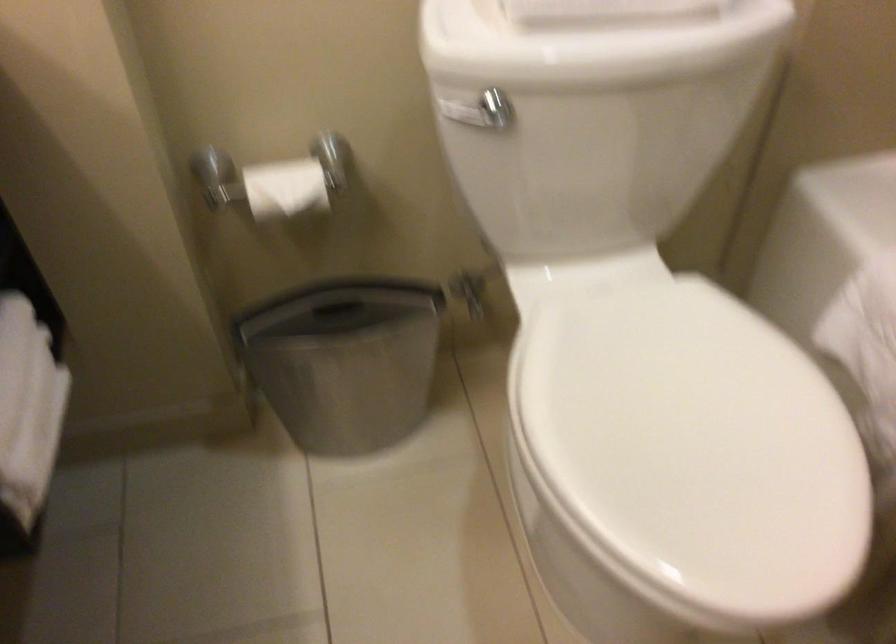
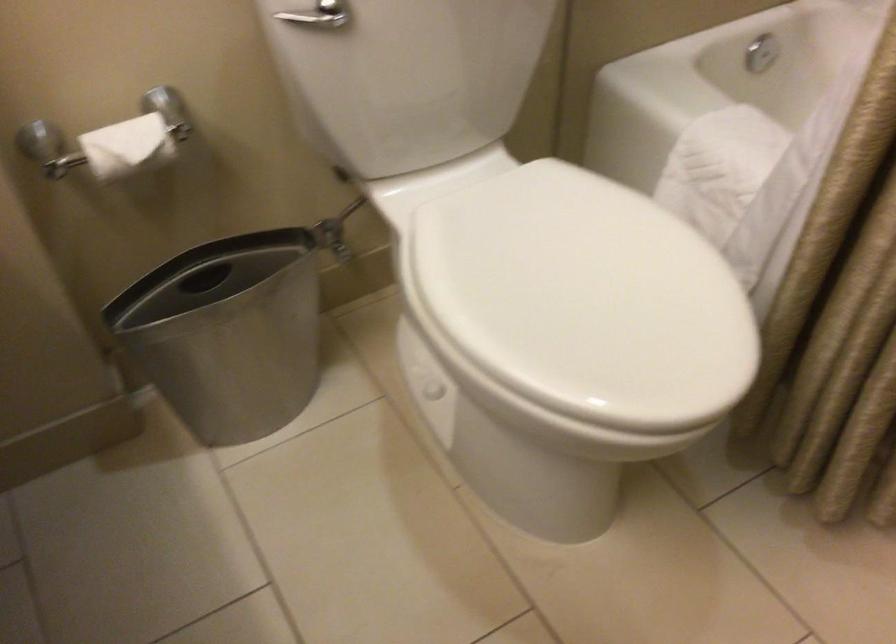
The point at (282, 185) is marked in the first image. Where is the corresponding point in the second image?

(126, 146)